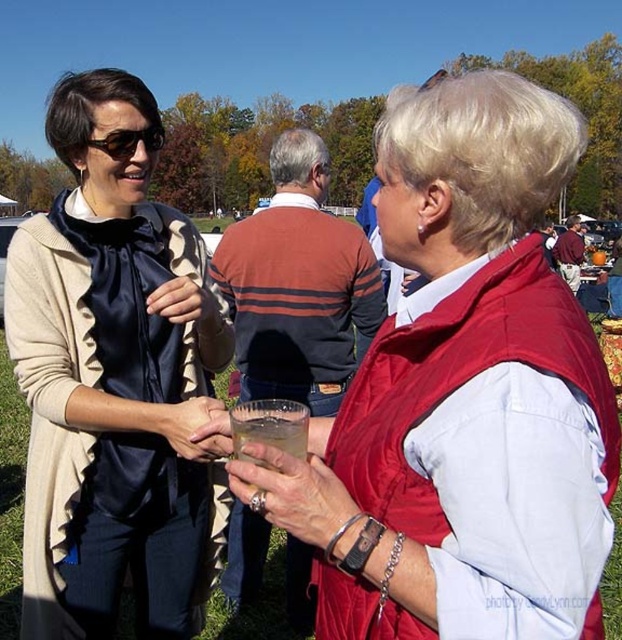
Question: Which of the following is the closest to the observer?

Choices:
 (A) matte black blouse at center
 (B) matte red vest at center
 (C) matte black sunglasses at upper left

Answer: (B)

Question: Is matte black blouse at center wider than matte black sunglasses at upper left?

Choices:
 (A) no
 (B) yes

Answer: (B)

Question: Can you confirm if matte red vest at center is positioned to the right of matte black blouse at center?

Choices:
 (A) no
 (B) yes

Answer: (B)

Question: In this image, where is matte red vest at center located relative to matte black sunglasses at upper left?

Choices:
 (A) below
 (B) above

Answer: (A)

Question: Which object is farther from the camera taking this photo?

Choices:
 (A) matte black blouse at center
 (B) matte black sunglasses at upper left
 (C) matte red vest at center

Answer: (B)

Question: Among these objects, which one is nearest to the camera?

Choices:
 (A) matte red vest at center
 (B) matte black blouse at center
 (C) matte black sunglasses at upper left

Answer: (A)